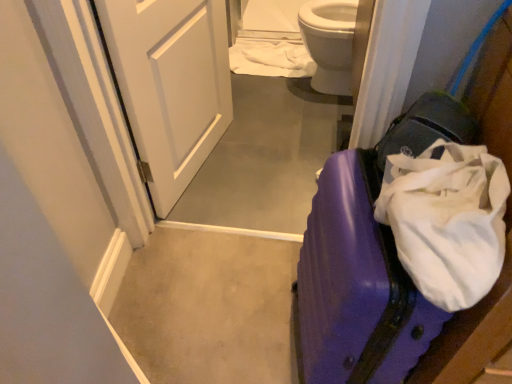
Question: Is white fabric at upper center positioned before white glossy door at upper left?

Choices:
 (A) yes
 (B) no

Answer: (B)

Question: From a real-world perspective, is white fabric at upper center below white glossy door at upper left?

Choices:
 (A) no
 (B) yes

Answer: (B)

Question: Is white fabric at upper center next to white glossy door at upper left?

Choices:
 (A) no
 (B) yes

Answer: (A)

Question: Considering the relative sizes of white fabric at upper center and white glossy door at upper left in the image provided, is white fabric at upper center smaller than white glossy door at upper left?

Choices:
 (A) no
 (B) yes

Answer: (B)

Question: Is white fabric at upper center bigger than white glossy door at upper left?

Choices:
 (A) no
 (B) yes

Answer: (A)

Question: In terms of width, does white glossy door at upper left look wider or thinner when compared to purple glossy suitcase at lower right?

Choices:
 (A) thin
 (B) wide

Answer: (A)

Question: Is white glossy door at upper left in front of or behind purple glossy suitcase at lower right in the image?

Choices:
 (A) front
 (B) behind

Answer: (B)

Question: Is white glossy door at upper left spatially inside purple glossy suitcase at lower right, or outside of it?

Choices:
 (A) outside
 (B) inside

Answer: (A)

Question: Does point (181, 11) appear closer or farther from the camera than point (345, 231)?

Choices:
 (A) closer
 (B) farther

Answer: (B)

Question: Does point (261, 67) appear closer or farther from the camera than point (187, 64)?

Choices:
 (A) farther
 (B) closer

Answer: (A)

Question: In the image, is white fabric at upper center positioned in front of or behind white glossy door at upper left?

Choices:
 (A) behind
 (B) front

Answer: (A)

Question: From a real-world perspective, is white fabric at upper center physically located above or below white glossy door at upper left?

Choices:
 (A) below
 (B) above

Answer: (A)

Question: Based on their sizes in the image, would you say white fabric at upper center is bigger or smaller than white glossy door at upper left?

Choices:
 (A) big
 (B) small

Answer: (B)

Question: In terms of width, does white glossy door at upper left look wider or thinner when compared to white fabric at upper center?

Choices:
 (A) wide
 (B) thin

Answer: (B)

Question: Choose the correct answer: Is white glossy door at upper left inside white fabric at upper center or outside it?

Choices:
 (A) inside
 (B) outside

Answer: (B)